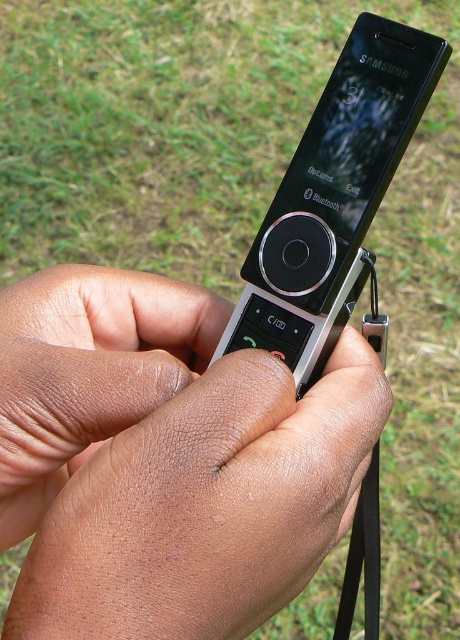
Question: Which point is closer to the camera?

Choices:
 (A) (327, 296)
 (B) (358, 563)
 (C) (38, 365)

Answer: (C)

Question: Is smooth skin hands at center to the right of black glossy phone at center from the viewer's perspective?

Choices:
 (A) yes
 (B) no

Answer: (B)

Question: Is the position of black glossy phone at center more distant than that of black rubber strap at lower right?

Choices:
 (A) no
 (B) yes

Answer: (B)

Question: Which object is positioned closest to the black rubber strap at lower right?

Choices:
 (A) smooth skin hands at center
 (B) black glossy phone at center

Answer: (B)

Question: Which point appears farthest from the camera in this image?

Choices:
 (A) (361, 499)
 (B) (139, 509)
 (C) (397, 54)

Answer: (A)

Question: Can you confirm if smooth skin hands at center is positioned below black rubber strap at lower right?

Choices:
 (A) yes
 (B) no

Answer: (B)